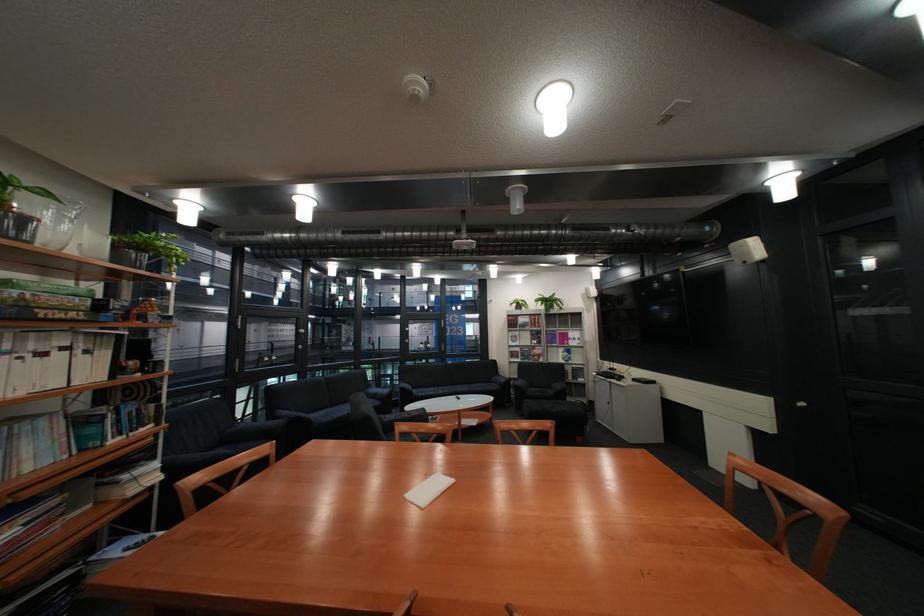
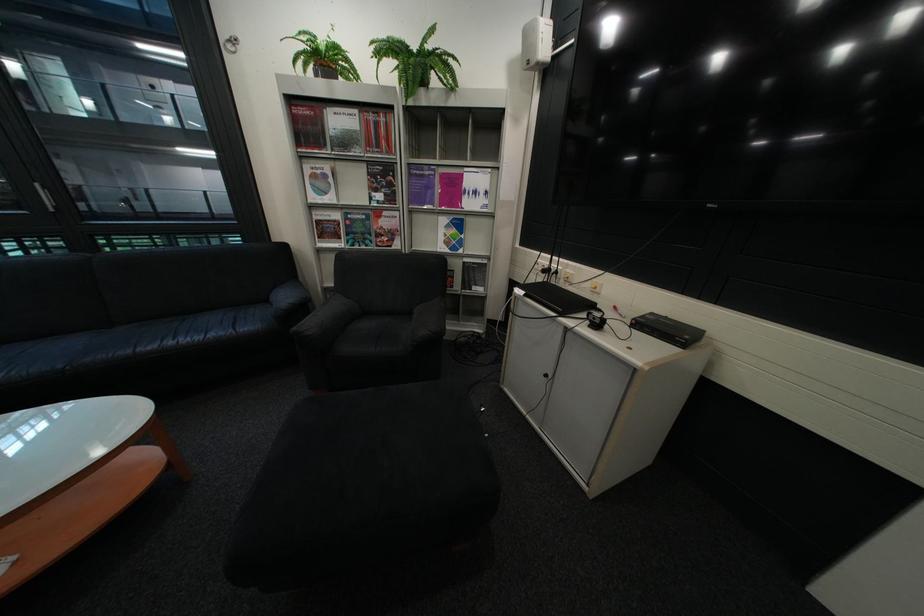
Where in the second image is the point corresponding to (527,336) from the first image?

(329, 177)